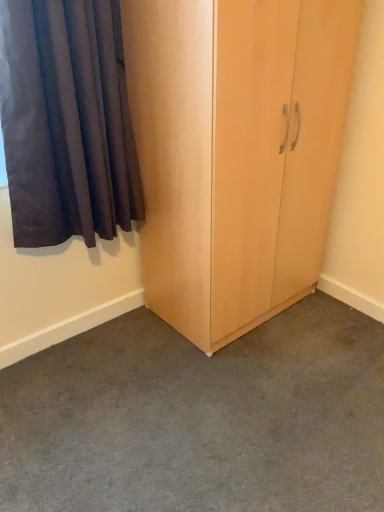
Locate an element on the screen. free space in front of light wood cupboard at center is located at coordinates (243, 390).